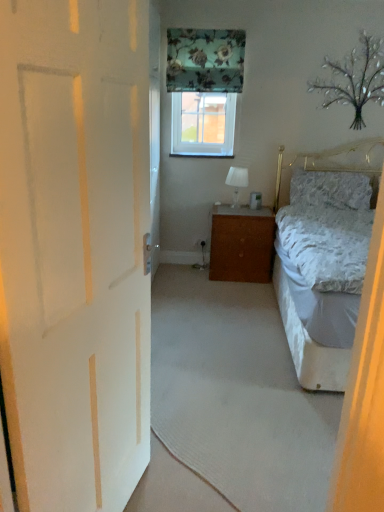
Identify the location of fluffy white pillow at right. pyautogui.click(x=331, y=189).

Which object is closer to the camera, clear glass window at center or fluffy white pillow at right?

fluffy white pillow at right is more forward.

Is clear glass window at center aimed at fluffy white pillow at right?

No, clear glass window at center is not oriented towards fluffy white pillow at right.

Does clear glass window at center have a lesser height compared to fluffy white pillow at right?

No.

Considering the relative sizes of clear glass window at center and fluffy white pillow at right in the image provided, is clear glass window at center smaller than fluffy white pillow at right?

Yes.

Is brown wood cabinet at center spatially inside fluffy white pillow at right, or outside of it?

brown wood cabinet at center is not enclosed by fluffy white pillow at right.

From the image's perspective, is brown wood cabinet at center beneath fluffy white pillow at right?

Correct, brown wood cabinet at center appears lower than fluffy white pillow at right in the image.

Consider the image. Relative to fluffy white pillow at right, is brown wood cabinet at center in front or behind?

Visually, brown wood cabinet at center is located in front of fluffy white pillow at right.

Considering the sizes of brown wood cabinet at center and fluffy white pillow at right in the image, is brown wood cabinet at center bigger or smaller than fluffy white pillow at right?

Clearly, brown wood cabinet at center is larger in size than fluffy white pillow at right.

Choose the correct answer: Is white fabric lampshade at center inside brown wood cabinet at center or outside it?

white fabric lampshade at center exists outside the volume of brown wood cabinet at center.

From a real-world perspective, is white fabric lampshade at center over brown wood cabinet at center?

Yes, from a real-world perspective, white fabric lampshade at center is over brown wood cabinet at center

Which of these two, white fabric lampshade at center or brown wood cabinet at center, is thinner?

white fabric lampshade at center.

From the image's perspective, which is below, white fabric lampshade at center or brown wood cabinet at center?

brown wood cabinet at center appears lower in the image.

Is brown wood cabinet at center to the left of white fabric lampshade at center from the viewer's perspective?

In fact, brown wood cabinet at center is to the right of white fabric lampshade at center.

Can you confirm if brown wood cabinet at center is smaller than white fabric lampshade at center?

Incorrect, brown wood cabinet at center is not smaller in size than white fabric lampshade at center.

Is brown wood cabinet at center in front of or behind white fabric lampshade at center in the image?

brown wood cabinet at center is in front of white fabric lampshade at center.

Can you confirm if white carpet at center is bigger than fluffy white pillow at right?

Correct, white carpet at center is larger in size than fluffy white pillow at right.

Can we say white carpet at center lies outside fluffy white pillow at right?

white carpet at center lies outside fluffy white pillow at right's area.

Where is `pillow behind the white carpet at center`? pillow behind the white carpet at center is located at coordinates (331, 189).

Is white carpet at center next to fluffy white pillow at right?

white carpet at center and fluffy white pillow at right are not in contact.

Is fluffy white pillow at right closer to camera compared to brown wood cabinet at center?

No, fluffy white pillow at right is behind brown wood cabinet at center.

Is fluffy white pillow at right not inside brown wood cabinet at center?

Yes, fluffy white pillow at right is located beyond the bounds of brown wood cabinet at center.

Does fluffy white pillow at right have a lesser width compared to brown wood cabinet at center?

Indeed, fluffy white pillow at right has a lesser width compared to brown wood cabinet at center.

Who is bigger, white matte door at left or fluffy white pillow at right?

Bigger between the two is white matte door at left.

Is white matte door at left taller or shorter than fluffy white pillow at right?

white matte door at left is taller than fluffy white pillow at right.

From a real-world perspective, is white matte door at left positioned over fluffy white pillow at right based on gravity?

Yes, from a real-world perspective, white matte door at left is above fluffy white pillow at right.

Consider the image. Could you tell me if white matte door at left is turned towards fluffy white pillow at right?

No, white matte door at left is not oriented towards fluffy white pillow at right.

Where is `pillow below the clear glass window at center (from a real-world perspective)`? pillow below the clear glass window at center (from a real-world perspective) is located at coordinates (331, 189).

Identify the location of cabinetry lying below the fluffy white pillow at right (from the image's perspective). This screenshot has height=512, width=384. (241, 244).

Which object lies nearer to the anchor point clear glass window at center, fluffy white pillow at right or white matte door at left?

Among the two, fluffy white pillow at right is located nearer to clear glass window at center.

Considering their positions, is white fabric lampshade at center positioned further to white carpet at center than clear glass window at center?

The object further to white carpet at center is clear glass window at center.

Looking at the image, which one is located further to brown wood cabinet at center, clear glass window at center or white matte door at left?

Based on the image, white matte door at left appears to be further to brown wood cabinet at center.

When comparing their distances from fluffy white pillow at right, does white matte door at left or clear glass window at center seem further?

white matte door at left is positioned further to the anchor fluffy white pillow at right.

Which object lies nearer to the anchor point fluffy white pillow at right, white carpet at center or brown wood cabinet at center?

The object closer to fluffy white pillow at right is brown wood cabinet at center.

Based on their spatial positions, is white carpet at center or white matte door at left further from white fabric lampshade at center?

Among the two, white matte door at left is located further to white fabric lampshade at center.

Based on their spatial positions, is white matte door at left or brown wood cabinet at center closer to clear glass window at center?

Among the two, brown wood cabinet at center is located nearer to clear glass window at center.

Considering their positions, is white fabric lampshade at center positioned further to fluffy white pillow at right than white matte door at left?

Among the two, white matte door at left is located further to fluffy white pillow at right.

Where is `cabinetry located between white carpet at center and fluffy white pillow at right in the depth direction`? This screenshot has height=512, width=384. cabinetry located between white carpet at center and fluffy white pillow at right in the depth direction is located at coordinates (241, 244).

This screenshot has width=384, height=512. What are the coordinates of `table lamp between clear glass window at center and brown wood cabinet at center in the up-down direction` in the screenshot? It's located at (237, 182).

Locate an element on the screen. pillow between white carpet at center and clear glass window at center in the front-back direction is located at coordinates (331, 189).

The image size is (384, 512). I want to click on plain between white matte door at left and white fabric lampshade at center in the front-back direction, so click(237, 395).